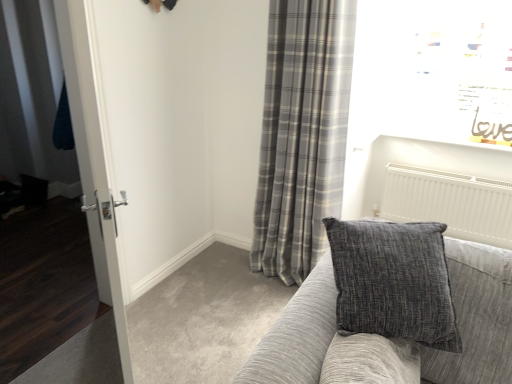
Question: In the image, is textured gray couch at center on the left side or the right side of gray plaid curtain at center?

Choices:
 (A) right
 (B) left

Answer: (A)

Question: Based on their sizes in the image, would you say textured gray couch at center is bigger or smaller than gray plaid curtain at center?

Choices:
 (A) big
 (B) small

Answer: (A)

Question: Based on their relative distances, which object is nearer to the white glossy door at left?

Choices:
 (A) gray plaid curtain at center
 (B) textured gray couch at center

Answer: (B)

Question: Which object is the farthest from the textured gray couch at center?

Choices:
 (A) gray plaid curtain at center
 (B) white glossy door at left

Answer: (A)